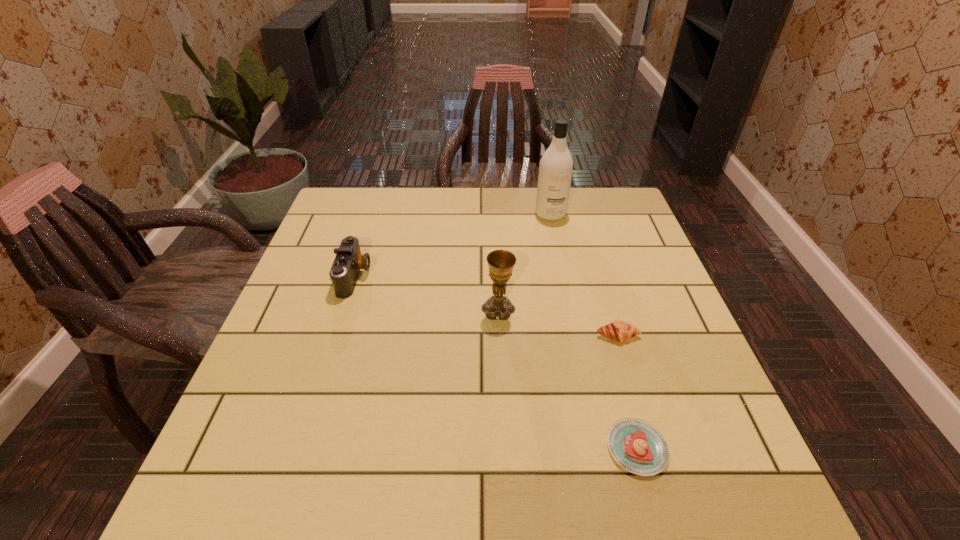
The height and width of the screenshot is (540, 960). I want to click on free space located on the left of the chalice, so click(349, 309).

Find the location of `free space located on the lens of the camera`. free space located on the lens of the camera is located at coordinates (439, 276).

You are a GUI agent. You are given a task and a screenshot of the screen. Output one action in this format:
    pyautogui.click(x=<x>, y=<y>)
    Task: Click on the free space located on the front-facing side of the fourth farthest object
    
    Given the screenshot: What is the action you would take?
    pyautogui.click(x=631, y=379)

The height and width of the screenshot is (540, 960). In order to click on vacant space located 0.280m on the back of the shortest object in this screenshot , I will do `click(600, 315)`.

This screenshot has width=960, height=540. I want to click on object positioned at the far edge, so click(x=555, y=172).

You are a GUI agent. You are given a task and a screenshot of the screen. Output one action in this format:
    pyautogui.click(x=<x>, y=<y>)
    Task: Click on the object at the near edge
    
    Given the screenshot: What is the action you would take?
    pyautogui.click(x=638, y=447)

You are a GUI agent. You are given a task and a screenshot of the screen. Output one action in this format:
    pyautogui.click(x=<x>, y=<y>)
    Task: Click on the object that is positioned at the left edge
    
    Given the screenshot: What is the action you would take?
    pyautogui.click(x=345, y=269)

The image size is (960, 540). What are the coordinates of `object positioned at the near right corner` in the screenshot? It's located at (638, 447).

Identify the location of vacant space at the far edge. Image resolution: width=960 pixels, height=540 pixels. (434, 228).

This screenshot has height=540, width=960. Identify the location of vacant space at the near edge. (412, 508).